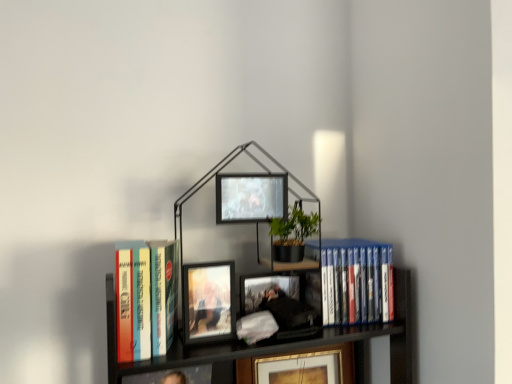
Question: From the image's perspective, would you say matte black picture frame at center, which is the first picture frame in top-to-bottom order, is positioned over hardcover books at left, arranged as the 2th book when viewed from the right?

Choices:
 (A) no
 (B) yes

Answer: (B)

Question: Is matte black picture frame at center, which ranks as the 2th picture frame in back-to-front order, facing towards hardcover books at left, the 1th book in the front-to-back sequence?

Choices:
 (A) yes
 (B) no

Answer: (B)

Question: Is matte black picture frame at center, which ranks as the 2th picture frame in back-to-front order, to the right of hardcover books at left, the 2th book when ordered from back to front, from the viewer's perspective?

Choices:
 (A) yes
 (B) no

Answer: (A)

Question: Is the depth of matte black picture frame at center, which is the second picture frame from front to back, greater than that of hardcover books at left, arranged as the 2th book when viewed from the right?

Choices:
 (A) no
 (B) yes

Answer: (B)

Question: From a real-world perspective, is matte black picture frame at center, marked as the 3th picture frame in a bottom-to-top arrangement, positioned under hardcover books at left, positioned as the first book in left-to-right order, based on gravity?

Choices:
 (A) no
 (B) yes

Answer: (A)

Question: Is matte wooden picture frame at center, the second picture frame viewed from the top, inside or outside of hardcover books at left, arranged as the 2th book when viewed from the right?

Choices:
 (A) outside
 (B) inside

Answer: (A)

Question: Would you say matte wooden picture frame at center, the second picture frame viewed from the top, is to the left or to the right of hardcover books at left, positioned as the first book in left-to-right order, in the picture?

Choices:
 (A) right
 (B) left

Answer: (A)

Question: Looking at their shapes, would you say matte wooden picture frame at center, the second picture frame viewed from the top, is wider or thinner than hardcover books at left, the 1th book in the front-to-back sequence?

Choices:
 (A) wide
 (B) thin

Answer: (B)

Question: In terms of height, does matte wooden picture frame at center, the second picture frame viewed from the top, look taller or shorter compared to hardcover books at left, arranged as the 2th book when viewed from the right?

Choices:
 (A) short
 (B) tall

Answer: (A)

Question: Based on their sizes in the image, would you say metallic black bookcase at center is bigger or smaller than matte black picture frame at center, which is the second picture frame from front to back?

Choices:
 (A) small
 (B) big

Answer: (B)

Question: From the image's perspective, is metallic black bookcase at center positioned above or below matte black picture frame at center, which is the second picture frame from front to back?

Choices:
 (A) below
 (B) above

Answer: (A)

Question: Considering the relative positions of metallic black bookcase at center and matte black picture frame at center, which is the first picture frame in top-to-bottom order, in the image provided, is metallic black bookcase at center to the left or to the right of matte black picture frame at center, which is the first picture frame in top-to-bottom order,?

Choices:
 (A) right
 (B) left

Answer: (B)

Question: In terms of height, does metallic black bookcase at center look taller or shorter compared to matte black picture frame at center, which is the second picture frame from front to back?

Choices:
 (A) short
 (B) tall

Answer: (B)

Question: Considering the positions of hardcover books at left, the 2th book when ordered from back to front, and metallic black bookcase at center in the image, is hardcover books at left, the 2th book when ordered from back to front, bigger or smaller than metallic black bookcase at center?

Choices:
 (A) small
 (B) big

Answer: (A)

Question: Visually, is hardcover books at left, positioned as the first book in left-to-right order, positioned to the left or to the right of metallic black bookcase at center?

Choices:
 (A) right
 (B) left

Answer: (B)